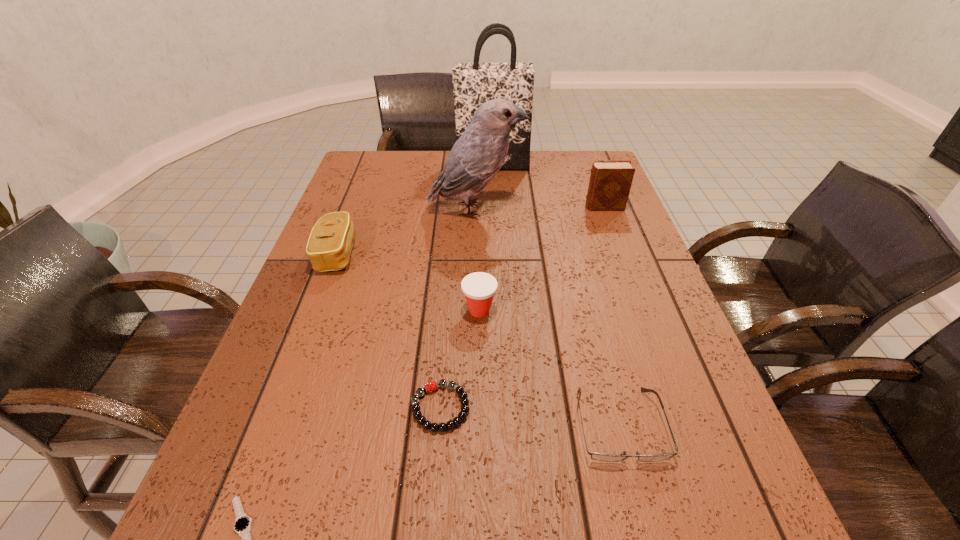
Identify the location of the tallest object. pyautogui.click(x=475, y=83).

Image resolution: width=960 pixels, height=540 pixels. In order to click on shopping bag in this screenshot , I will do `click(475, 83)`.

Find the location of a particular element. Image resolution: width=960 pixels, height=540 pixels. the second tallest object is located at coordinates coord(476,157).

Image resolution: width=960 pixels, height=540 pixels. What are the coordinates of `the third tallest object` in the screenshot? It's located at (610, 182).

Locate an element on the screen. Image resolution: width=960 pixels, height=540 pixels. the fourth farthest object is located at coordinates (329, 246).

Locate an element on the screen. This screenshot has width=960, height=540. Dixie cup is located at coordinates (479, 288).

Where is `spectacles`? spectacles is located at coordinates (595, 456).

Locate an element on the screen. the second shortest object is located at coordinates (432, 386).

I want to click on vacant area situated on the front of the farthest object with the design, so click(494, 241).

Identify the location of free spot located on the front-facing side of the parrot. (617, 210).